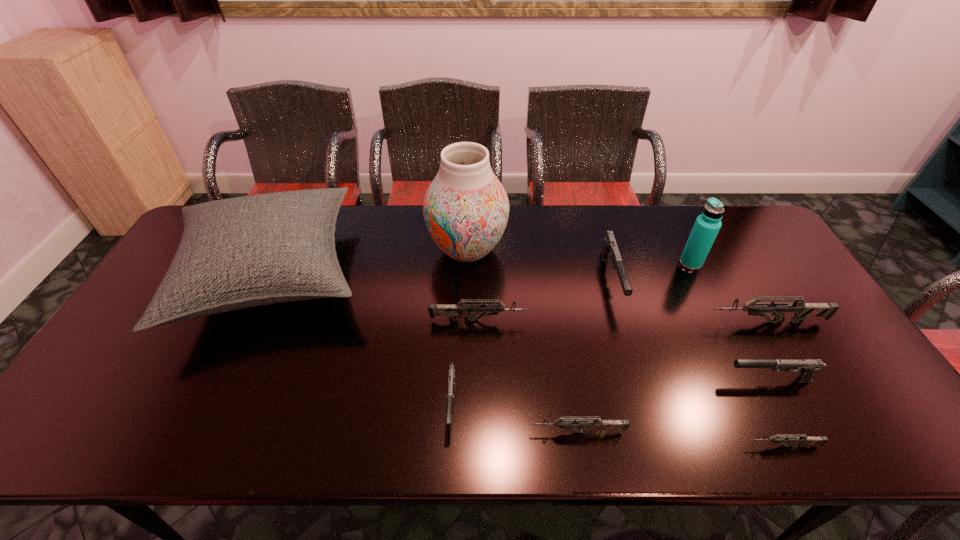
Identify which gun is located as the sixth nearest to the tallest object. Please provide its 2D coordinates. Your answer should be formatted as a tuple, i.e. [(x, y)], where the tuple contains the x and y coordinates of a point satisfying the conditions above.

[(806, 368)]

Image resolution: width=960 pixels, height=540 pixels. I want to click on gun that is the second closest one to the third smallest grey gun, so click(x=610, y=249).

Select which gray gun is the third closest to the smallest grey gun. Please provide its 2D coordinates. Your answer should be formatted as a tuple, i.e. [(x, y)], where the tuple contains the x and y coordinates of a point satisfying the conditions above.

[(451, 372)]

Select which gray gun appears as the closest to the second smallest grey gun. Please provide its 2D coordinates. Your answer should be formatted as a tuple, i.e. [(x, y)], where the tuple contains the x and y coordinates of a point satisfying the conditions above.

[(451, 372)]

This screenshot has height=540, width=960. In order to click on the second closest grey gun to the leftmost object in this screenshot , I will do `click(585, 423)`.

Select which grey gun appears as the closest to the second biggest grey gun. Please provide its 2D coordinates. Your answer should be formatted as a tuple, i.e. [(x, y)], where the tuple contains the x and y coordinates of a point satisfying the conditions above.

[(585, 423)]